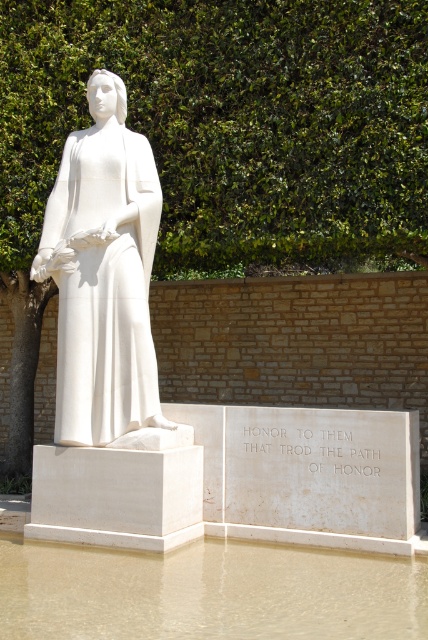
Is point (374, 40) farther from camera compared to point (88, 330)?

Yes, point (374, 40) is behind point (88, 330).

Does green leafy hedge at upper center lie in front of white marble statue at center?

No.

What do you see at coordinates (231, 120) in the screenshot?
I see `green leafy hedge at upper center` at bounding box center [231, 120].

This screenshot has height=640, width=428. What are the coordinates of `green leafy hedge at upper center` in the screenshot? It's located at (231, 120).

You are a GUI agent. You are given a task and a screenshot of the screen. Output one action in this format:
    pyautogui.click(x=<x>, y=<y>)
    Task: Click on the green leafy hedge at upper center
    The image size is (428, 640).
    Given the screenshot: What is the action you would take?
    pyautogui.click(x=231, y=120)

Does green leafy hedge at upper center have a greater width compared to brown sediment water at lower center?

Yes.

Which is in front, point (255, 205) or point (403, 580)?

Point (403, 580) is more forward.

Where is `green leafy hedge at upper center`? The height and width of the screenshot is (640, 428). green leafy hedge at upper center is located at coordinates (231, 120).

Is brown sediment water at lower center below white marble statue at center?

Indeed, brown sediment water at lower center is positioned under white marble statue at center.

Is brown sediment water at lower center smaller than white marble statue at center?

Indeed, brown sediment water at lower center has a smaller size compared to white marble statue at center.

This screenshot has height=640, width=428. I want to click on brown sediment water at lower center, so click(208, 593).